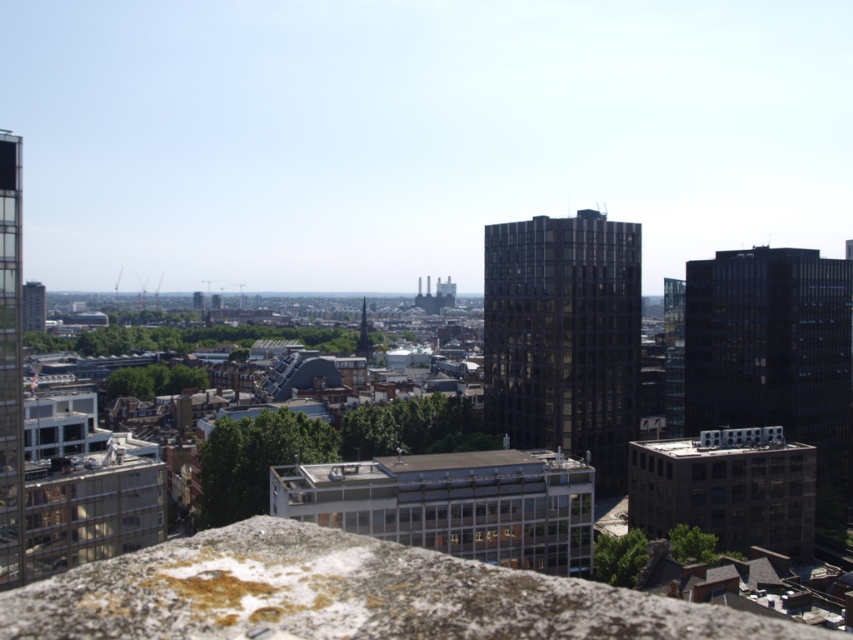
You are standing on the stone ledge in the foreground of the urban landscape. You notice two dark glass buildings in the distance. Which one, the dark glass building at center or the dark glass building at right, appears nearer to you?

The dark glass building at center is closer to the viewer than the dark glass building at right, so the dark glass building at center appears nearer.

You are standing at the vantage point overlooking the city. A dark glass building at center is marked by point (564, 337). If you were to walk directly towards that point, would you first encounter the textured stone ledge or the modern high rise buildings?

The dark glass building at center is represented by point (564, 337). Since the stone ledge is in the foreground and the modern high rises are in the midground, walking towards the point would first encounter the stone ledge before reaching the buildings.